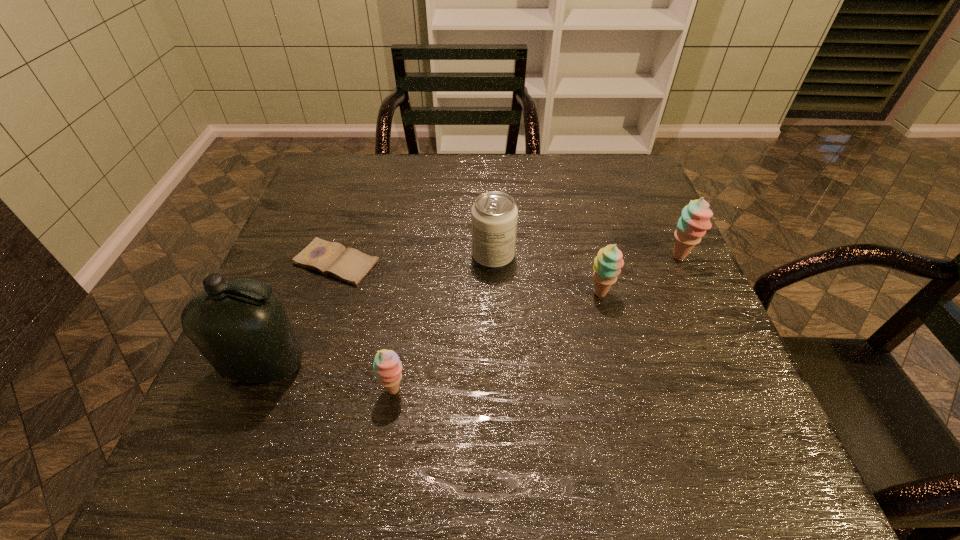
Please determine a free point for an extra sherbert to ensure balance. Please provide its 2D coordinates. Your answer should be formatted as a tuple, i.e. [(x, y)], where the tuple contains the x and y coordinates of a point satisfying the conditions above.

[(507, 338)]